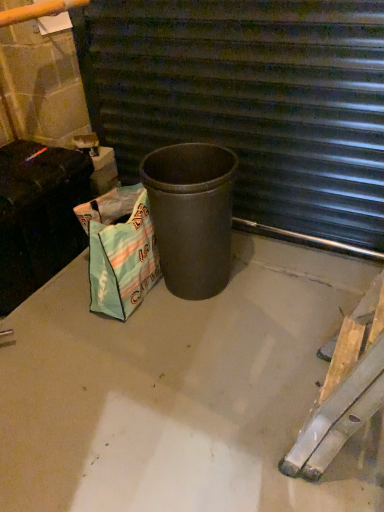
Identify the location of unoccupied region to the right of matte black trash can at center. The width and height of the screenshot is (384, 512). (279, 281).